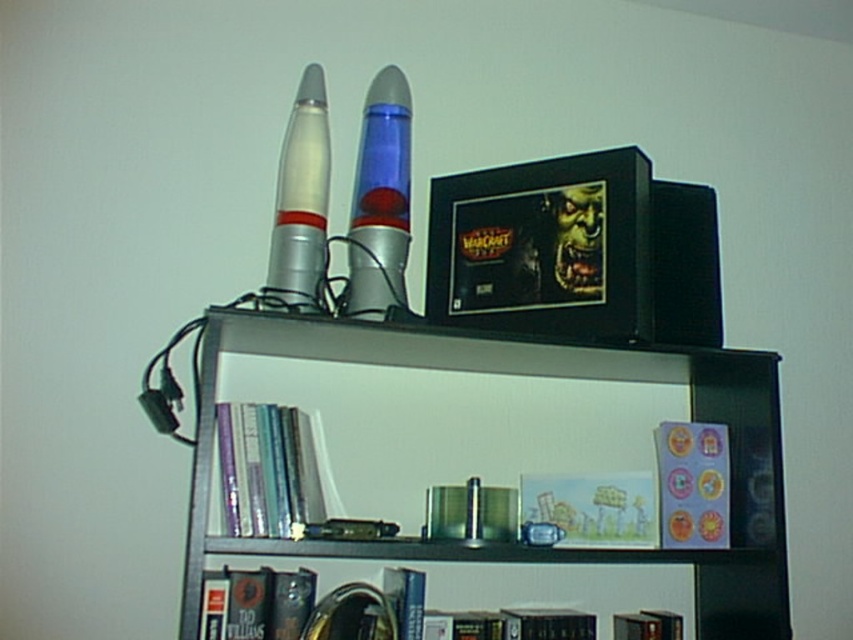
Which is above, translucent blue liquid at upper center or hardcover book at lower center?

translucent blue liquid at upper center

Identify the location of translucent blue liquid at upper center. Image resolution: width=853 pixels, height=640 pixels. (380, 198).

Between silver metallic rocket at upper left and hardcover book at lower center, which one appears on the left side from the viewer's perspective?

silver metallic rocket at upper left

Does silver metallic rocket at upper left have a lesser width compared to hardcover book at lower center?

In fact, silver metallic rocket at upper left might be wider than hardcover book at lower center.

Is point (318, 272) closer to viewer compared to point (663, 628)?

Yes, it is in front of point (663, 628).

The height and width of the screenshot is (640, 853). Find the location of `silver metallic rocket at upper left`. silver metallic rocket at upper left is located at coordinates (300, 200).

Who is shorter, metallic silver bookcase at upper center or silver metallic rocket at upper left?

silver metallic rocket at upper left is shorter.

Which is more to the right, metallic silver bookcase at upper center or silver metallic rocket at upper left?

metallic silver bookcase at upper center is more to the right.

Who is more forward, (640, 406) or (286, 161)?

Point (286, 161) is more forward.

Locate an element on the screen. This screenshot has width=853, height=640. metallic silver bookcase at upper center is located at coordinates (498, 458).